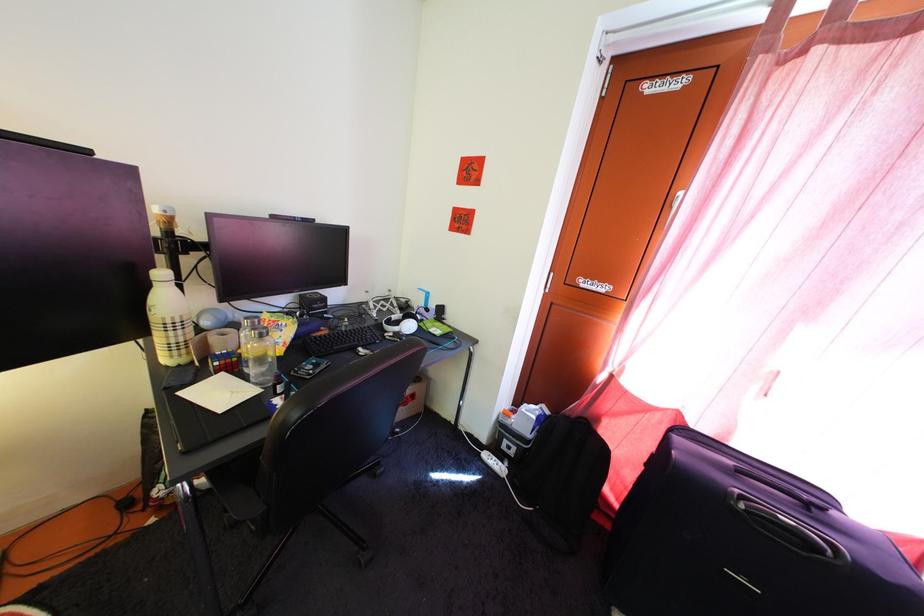
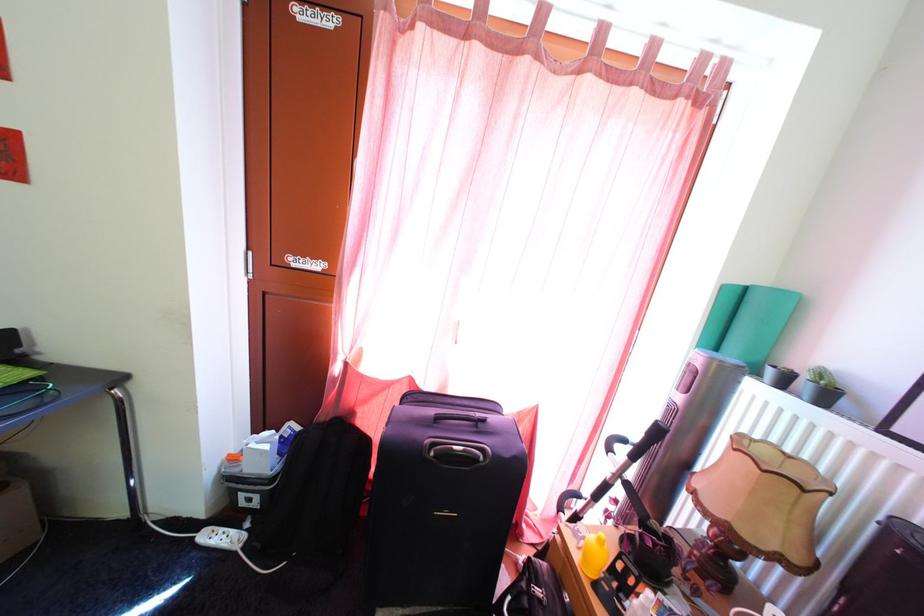
The point at (751, 506) is marked in the first image. Where is the corresponding point in the second image?

(441, 454)